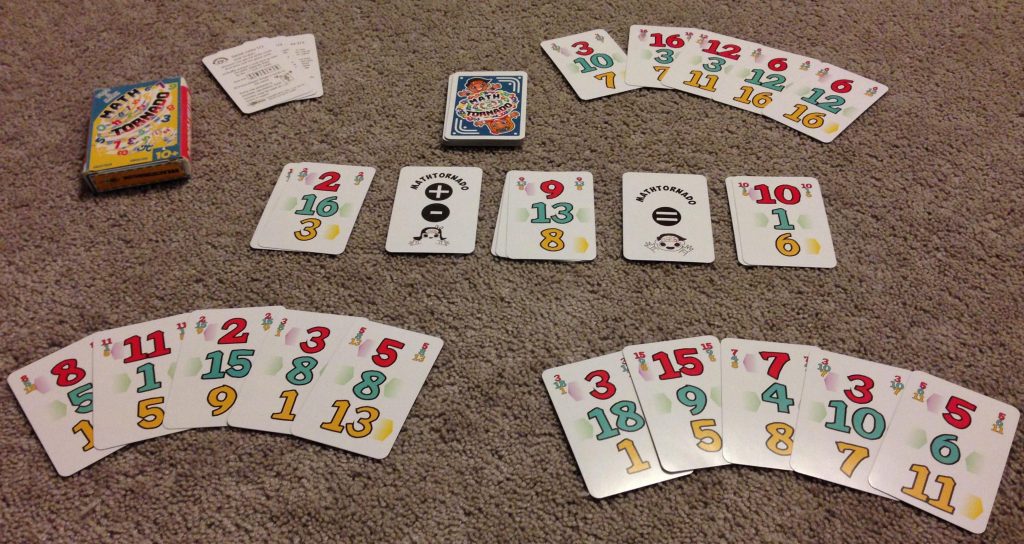
The width and height of the screenshot is (1024, 544). I want to click on carpet, so click(x=509, y=319).